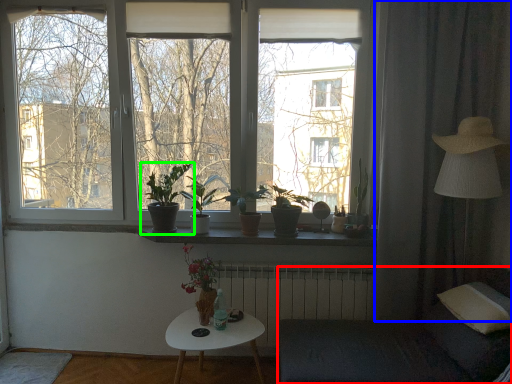
Question: Which is nearer to the armchair (highlighted by a red box)? curtain (highlighted by a blue box) or houseplant (highlighted by a green box).

Choices:
 (A) curtain
 (B) houseplant

Answer: (A)